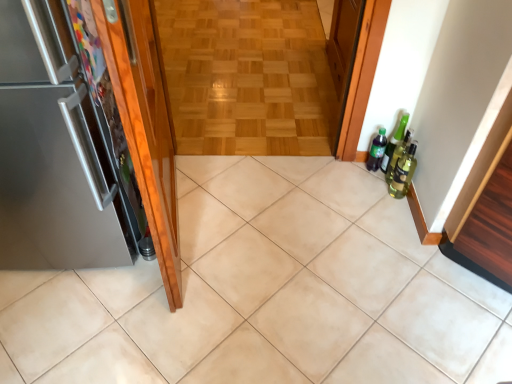
Question: Looking at the image, does wooden parquet floor at center seem bigger or smaller compared to shiny wood door at left, arranged as the first door when viewed from the right?

Choices:
 (A) small
 (B) big

Answer: (A)

Question: In terms of height, does wooden parquet floor at center look taller or shorter compared to shiny wood door at left, arranged as the first door when viewed from the right?

Choices:
 (A) tall
 (B) short

Answer: (B)

Question: Considering the real-world distances, which object is farthest from the wooden cabinet at right?

Choices:
 (A) green matte bottle at right
 (B) wooden parquet floor at center
 (C) green glass bottle at right, the 1th beer bottle viewed from the front
 (D) green glass beer bottle at right, which is counted as the 2th beer bottle, starting from the front
 (E) satin metallic refrigerator at left, the 1th door in the left-to-right sequence

Answer: (B)

Question: Which object is positioned farthest from the satin metallic refrigerator at left, the 1th door in the left-to-right sequence?

Choices:
 (A) beige ceramic tile at center
 (B) wooden cabinet at right
 (C) green glass beer bottle at right, the first beer bottle positioned from the back
 (D) shiny wood door at left, arranged as the first door when viewed from the right
 (E) wooden parquet floor at center

Answer: (E)